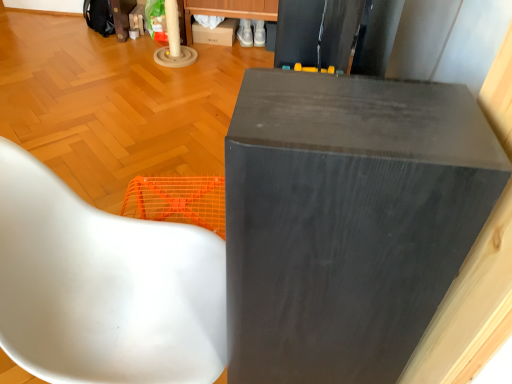
The height and width of the screenshot is (384, 512). Find the location of `matte cardboard box at upper center`. matte cardboard box at upper center is located at coordinates (216, 33).

This screenshot has width=512, height=384. What do you see at coordinates (347, 220) in the screenshot? I see `matte black speaker at upper center` at bounding box center [347, 220].

Find the location of a particular element. The height and width of the screenshot is (384, 512). matte cardboard box at upper center is located at coordinates (216, 33).

Between matte cardboard box at upper center and matte black speaker at upper center, which one has less height?

matte cardboard box at upper center is shorter.

Is matte black speaker at upper center completely or partially inside matte cardboard box at upper center?

No, matte black speaker at upper center is not surrounded by matte cardboard box at upper center.

Is matte cardboard box at upper center wider than matte black speaker at upper center?

Yes.

Is the position of matte cardboard box at upper center less distant than that of white glossy chair at lower left?

No, matte cardboard box at upper center is behind white glossy chair at lower left.

Which is farther from the camera, (194, 29) or (102, 268)?

The point (194, 29) is farther.

Does matte cardboard box at upper center appear on the left side of white glossy chair at lower left?

No, matte cardboard box at upper center is not to the left of white glossy chair at lower left.

From a real-world perspective, is matte cardboard box at upper center physically below white glossy chair at lower left?

Yes, from a real-world perspective, matte cardboard box at upper center is below white glossy chair at lower left.

Based on the photo, considering the relative sizes of matte black speaker at upper center and matte cardboard box at upper center in the image provided, is matte black speaker at upper center shorter than matte cardboard box at upper center?

No, matte black speaker at upper center is not shorter than matte cardboard box at upper center.

Is matte black speaker at upper center spatially inside matte cardboard box at upper center, or outside of it?

matte black speaker at upper center is spatially situated outside matte cardboard box at upper center.

Between matte black speaker at upper center and matte cardboard box at upper center, which one appears on the right side from the viewer's perspective?

matte black speaker at upper center is more to the right.

Based on the photo, does matte black speaker at upper center turn towards matte cardboard box at upper center?

No.

Could you tell me if white glossy chair at lower left is facing matte cardboard box at upper center?

No.

How far apart are white glossy chair at lower left and matte cardboard box at upper center?

white glossy chair at lower left and matte cardboard box at upper center are 7.97 feet apart from each other.

Is white glossy chair at lower left taller than matte cardboard box at upper center?

Yes.

From a real-world perspective, between white glossy chair at lower left and matte cardboard box at upper center, who is vertically higher?

In real-world perspective, white glossy chair at lower left is above.

Between white glossy chair at lower left and matte black speaker at upper center, which one has more height?

matte black speaker at upper center is taller.

From a real-world perspective, relative to matte black speaker at upper center, is white glossy chair at lower left vertically above or below?

From a real-world perspective, white glossy chair at lower left is physically below matte black speaker at upper center.

From the image's perspective, which is above, white glossy chair at lower left or matte black speaker at upper center?

white glossy chair at lower left, from the image's perspective.

Based on their sizes in the image, would you say white glossy chair at lower left is bigger or smaller than matte black speaker at upper center?

Considering their sizes, white glossy chair at lower left takes up more space than matte black speaker at upper center.

Is matte black speaker at upper center beside white glossy chair at lower left?

matte black speaker at upper center and white glossy chair at lower left are not in contact.

The image size is (512, 384). Identify the location of furniture on the right of white glossy chair at lower left. (347, 220).

Does matte black speaker at upper center have a greater height compared to white glossy chair at lower left?

Yes, matte black speaker at upper center is taller than white glossy chair at lower left.

How distant is matte black speaker at upper center from white glossy chair at lower left?

matte black speaker at upper center and white glossy chair at lower left are 15.02 inches apart from each other.

Locate an element on the screen. This screenshot has height=384, width=512. cardboard box below the matte black speaker at upper center (from a real-world perspective) is located at coordinates (216, 33).

Identify the location of chair in front of the matte cardboard box at upper center. Image resolution: width=512 pixels, height=384 pixels. (104, 287).

From the image, which object appears to be nearer to matte cardboard box at upper center, matte black speaker at upper center or white glossy chair at lower left?

Based on the image, white glossy chair at lower left appears to be nearer to matte cardboard box at upper center.

Based on their spatial positions, is matte black speaker at upper center or matte cardboard box at upper center closer to white glossy chair at lower left?

matte black speaker at upper center.

From the image, which object appears to be farther from white glossy chair at lower left, matte cardboard box at upper center or matte black speaker at upper center?

matte cardboard box at upper center is further to white glossy chair at lower left.

From the image, which object appears to be farther from matte black speaker at upper center, white glossy chair at lower left or matte cardboard box at upper center?

The object further to matte black speaker at upper center is matte cardboard box at upper center.

Estimate the real-world distances between objects in this image. Which object is further from matte black speaker at upper center, matte cardboard box at upper center or white glossy chair at lower left?

Based on the image, matte cardboard box at upper center appears to be further to matte black speaker at upper center.

In the scene shown: Looking at the image, which one is located closer to matte cardboard box at upper center, white glossy chair at lower left or matte black speaker at upper center?

white glossy chair at lower left is closer to matte cardboard box at upper center.

Find the location of `chair between matte black speaker at upper center and matte cardboard box at upper center from front to back`. chair between matte black speaker at upper center and matte cardboard box at upper center from front to back is located at coordinates (104, 287).